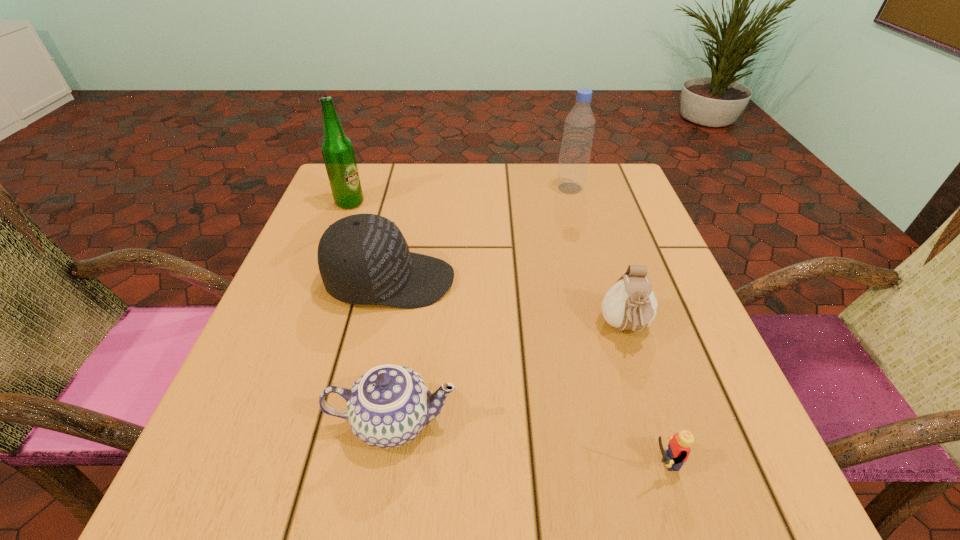
Where is `empty space between the chinaware and the baseball cap`? The height and width of the screenshot is (540, 960). empty space between the chinaware and the baseball cap is located at coordinates (392, 351).

Find the location of a particular element. vacant area that lies between the pouch and the bottle is located at coordinates (597, 258).

The image size is (960, 540). Find the location of `object that is the third closest to the baseball cap`. object that is the third closest to the baseball cap is located at coordinates (630, 304).

Identify which object is the fourth nearest to the pouch. Please provide its 2D coordinates. Your answer should be formatted as a tuple, i.e. [(x, y)], where the tuple contains the x and y coordinates of a point satisfying the conditions above.

[(579, 126)]

At what (x,y) coordinates should I click in order to perform the action: click on vacant space that satisfies the following two spatial constraints: 1. on the front-facing side of the pouch; 2. from the spout of the chinaware. Please return your answer as a coordinate pair (x, y). The width and height of the screenshot is (960, 540). Looking at the image, I should click on (655, 421).